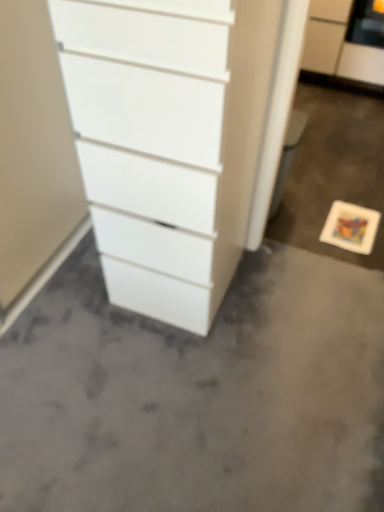
Identify the location of vacant point above gray matte concrete at center (from a real-world perspective). The height and width of the screenshot is (512, 384). (193, 375).